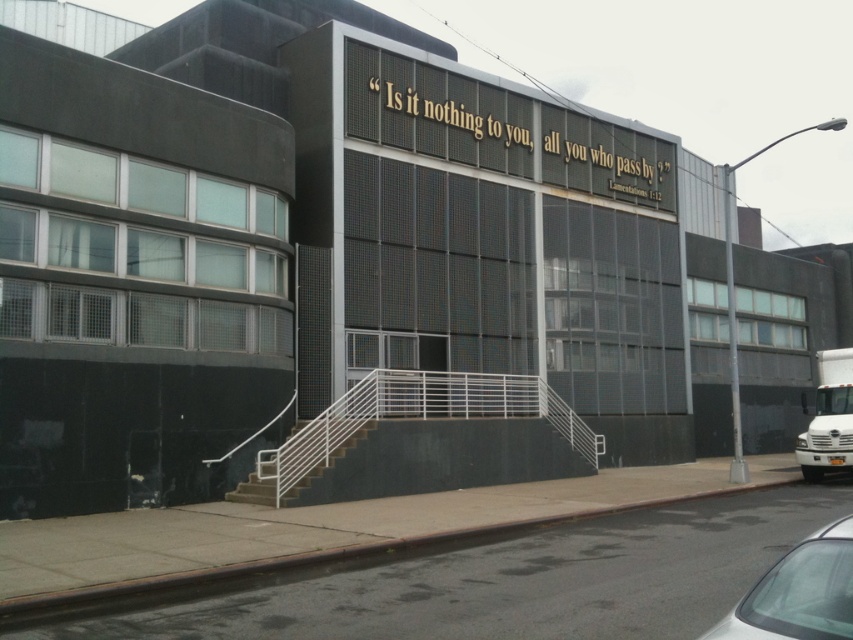
Question: Is silver metallic car at lower right thinner than concrete stairs at center?

Choices:
 (A) no
 (B) yes

Answer: (B)

Question: Among these objects, which one is farthest from the camera?

Choices:
 (A) concrete stairs at center
 (B) silver metallic car at lower right

Answer: (A)

Question: Is silver metallic car at lower right positioned before concrete stairs at center?

Choices:
 (A) no
 (B) yes

Answer: (B)

Question: Among these points, which one is nearest to the camera?

Choices:
 (A) (848, 609)
 (B) (309, 481)

Answer: (A)

Question: Does silver metallic car at lower right appear on the left side of concrete stairs at center?

Choices:
 (A) no
 (B) yes

Answer: (A)